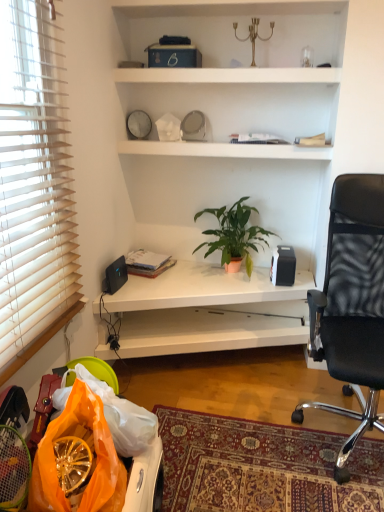
Where is `matte silver clock at upper center`? This screenshot has width=384, height=512. matte silver clock at upper center is located at coordinates (138, 124).

The height and width of the screenshot is (512, 384). Describe the element at coordinates (352, 304) in the screenshot. I see `black mesh office chair at right` at that location.

I want to click on black plastic speaker at lower left, the 1th loudspeaker when ordered from left to right, so click(x=116, y=275).

What do you see at coordinates (234, 234) in the screenshot? I see `green matte plant at center` at bounding box center [234, 234].

The image size is (384, 512). Find the location of `matte silver clock at upper center`. matte silver clock at upper center is located at coordinates (138, 124).

In the scene shown: Considering the relative sizes of white glossy desk at center and green matte plant at center in the image provided, is white glossy desk at center wider than green matte plant at center?

Yes.

Is point (139, 284) in front of point (237, 251)?

Yes.

Is white glossy desk at center far from green matte plant at center?

No, white glossy desk at center is not far away from green matte plant at center.

Can you confirm if white glossy desk at center is thinner than black matte speaker at upper right, which ranks as the second loudspeaker in left-to-right order?

In fact, white glossy desk at center might be wider than black matte speaker at upper right, which ranks as the second loudspeaker in left-to-right order.

Relative to black matte speaker at upper right, acting as the first loudspeaker starting from the right, is white glossy desk at center in front or behind?

Clearly, white glossy desk at center is in front of black matte speaker at upper right, acting as the first loudspeaker starting from the right.

Does white glossy desk at center touch black matte speaker at upper right, acting as the first loudspeaker starting from the right?

white glossy desk at center and black matte speaker at upper right, acting as the first loudspeaker starting from the right, are clearly separated.

Looking at this image, from the image's perspective, which is above, white glossy desk at center or black matte speaker at upper right, which ranks as the second loudspeaker in left-to-right order?

From the image's view, black matte speaker at upper right, which ranks as the second loudspeaker in left-to-right order, is above.

How many degrees apart are the facing directions of black plastic speaker at lower left, which is the second loudspeaker from right to left, and black matte speaker at upper right, which ranks as the second loudspeaker in left-to-right order?

There is a 89.7-degree angle between the facing directions of black plastic speaker at lower left, which is the second loudspeaker from right to left, and black matte speaker at upper right, which ranks as the second loudspeaker in left-to-right order.

From the image's perspective, which is below, black plastic speaker at lower left, the 1th loudspeaker when ordered from left to right, or black matte speaker at upper right, acting as the first loudspeaker starting from the right?

black plastic speaker at lower left, the 1th loudspeaker when ordered from left to right, is shown below in the image.

Between black plastic speaker at lower left, which is the second loudspeaker from right to left, and black matte speaker at upper right, which ranks as the second loudspeaker in left-to-right order, which one is positioned behind?

black matte speaker at upper right, which ranks as the second loudspeaker in left-to-right order, is behind.

Between black plastic speaker at lower left, which is the second loudspeaker from right to left, and black matte speaker at upper right, which ranks as the second loudspeaker in left-to-right order, which one appears on the left side from the viewer's perspective?

From the viewer's perspective, black plastic speaker at lower left, which is the second loudspeaker from right to left, appears more on the left side.

Considering the positions of points (230, 211) and (134, 126), is point (230, 211) closer to camera compared to point (134, 126)?

That is False.

Who is taller, green matte plant at center or matte silver clock at upper center?

With more height is green matte plant at center.

From a real-world perspective, is green matte plant at center under matte silver clock at upper center?

Yes, from a real-world perspective, green matte plant at center is below matte silver clock at upper center.

Considering the positions of objects green matte plant at center and matte silver clock at upper center in the image provided, who is behind, green matte plant at center or matte silver clock at upper center?

matte silver clock at upper center is further away from the camera.

What's the angular difference between green matte plant at center and matte black book at left's facing directions?

10.6 degrees separate the facing orientations of green matte plant at center and matte black book at left.

Considering the sizes of objects green matte plant at center and matte black book at left in the image provided, who is wider, green matte plant at center or matte black book at left?

With larger width is green matte plant at center.

Considering the relative sizes of green matte plant at center and matte black book at left in the image provided, is green matte plant at center taller than matte black book at left?

Indeed, green matte plant at center has a greater height compared to matte black book at left.

Which is more to the left, green matte plant at center or matte black book at left?

matte black book at left.

Is black matte speaker at upper right, acting as the first loudspeaker starting from the right, not near black plastic speaker at lower left, which is the second loudspeaker from right to left?

No, black matte speaker at upper right, acting as the first loudspeaker starting from the right, is not far away from black plastic speaker at lower left, which is the second loudspeaker from right to left.

Is black matte speaker at upper right, which ranks as the second loudspeaker in left-to-right order, to the left of black plastic speaker at lower left, which is the second loudspeaker from right to left, from the viewer's perspective?

No.

From a real-world perspective, does black matte speaker at upper right, which ranks as the second loudspeaker in left-to-right order, sit lower than black plastic speaker at lower left, the 1th loudspeaker when ordered from left to right?

No, from a real-world perspective, black matte speaker at upper right, which ranks as the second loudspeaker in left-to-right order, is not below black plastic speaker at lower left, the 1th loudspeaker when ordered from left to right.

Does black matte speaker at upper right, acting as the first loudspeaker starting from the right, have a larger size compared to black plastic speaker at lower left, the 1th loudspeaker when ordered from left to right?

Yes.

Is matte silver clock at upper center at the right side of green matte plant at center?

No, matte silver clock at upper center is not to the right of green matte plant at center.

Which of these two, matte silver clock at upper center or green matte plant at center, is smaller?

matte silver clock at upper center.

From the image's perspective, is matte silver clock at upper center positioned above or below green matte plant at center?

Clearly, from the image's perspective, matte silver clock at upper center is above green matte plant at center.

How different are the orientations of matte silver clock at upper center and green matte plant at center in degrees?

The angular difference between matte silver clock at upper center and green matte plant at center is 8.27 degrees.

Where is `desk in front of the green matte plant at center`? The image size is (384, 512). desk in front of the green matte plant at center is located at coordinates (208, 311).

From the image's perspective, which loudspeaker is the 2nd one above the white glossy desk at center? Please provide its 2D coordinates.

[(283, 266)]

Based on their spatial positions, is matte silver clock at upper center or green matte plant at center further from black plastic speaker at lower left, which is the second loudspeaker from right to left?

The object further to black plastic speaker at lower left, which is the second loudspeaker from right to left, is matte silver clock at upper center.

Considering their positions, is black mesh office chair at right positioned further to white glossy desk at center than matte black book at left?

black mesh office chair at right is positioned further to the anchor white glossy desk at center.

Considering their positions, is black mesh office chair at right positioned further to black plastic speaker at lower left, the 1th loudspeaker when ordered from left to right, than white glossy desk at center?

black mesh office chair at right is positioned further to the anchor black plastic speaker at lower left, the 1th loudspeaker when ordered from left to right.

Looking at the image, which one is located closer to green matte plant at center, black mesh office chair at right or black matte speaker at upper right, acting as the first loudspeaker starting from the right?

The object closer to green matte plant at center is black matte speaker at upper right, acting as the first loudspeaker starting from the right.

Which object lies nearer to the anchor point matte black book at left, black mesh office chair at right or black plastic speaker at lower left, which is the second loudspeaker from right to left?

Based on the image, black plastic speaker at lower left, which is the second loudspeaker from right to left, appears to be nearer to matte black book at left.

Estimate the real-world distances between objects in this image. Which object is further from black matte speaker at upper right, which ranks as the second loudspeaker in left-to-right order, matte black book at left or black plastic speaker at lower left, the 1th loudspeaker when ordered from left to right?

black plastic speaker at lower left, the 1th loudspeaker when ordered from left to right, is positioned further to the anchor black matte speaker at upper right, which ranks as the second loudspeaker in left-to-right order.

Based on their spatial positions, is white glossy desk at center or matte black book at left closer to black mesh office chair at right?

The object closer to black mesh office chair at right is white glossy desk at center.

Considering their positions, is green matte plant at center positioned further to matte silver clock at upper center than black matte speaker at upper right, which ranks as the second loudspeaker in left-to-right order?

The object further to matte silver clock at upper center is black matte speaker at upper right, which ranks as the second loudspeaker in left-to-right order.

In order to click on desk between black plastic speaker at lower left, which is the second loudspeaker from right to left, and black mesh office chair at right from left to right in this screenshot , I will do `click(208, 311)`.

Locate an element on the screen. The width and height of the screenshot is (384, 512). houseplant between matte silver clock at upper center and white glossy desk at center vertically is located at coordinates (234, 234).

The width and height of the screenshot is (384, 512). I want to click on desk between black mesh office chair at right and matte black book at left in the front-back direction, so click(208, 311).

Find the location of a particular element. The width and height of the screenshot is (384, 512). clock between black plastic speaker at lower left, which is the second loudspeaker from right to left, and black mesh office chair at right, in the horizontal direction is located at coordinates (138, 124).